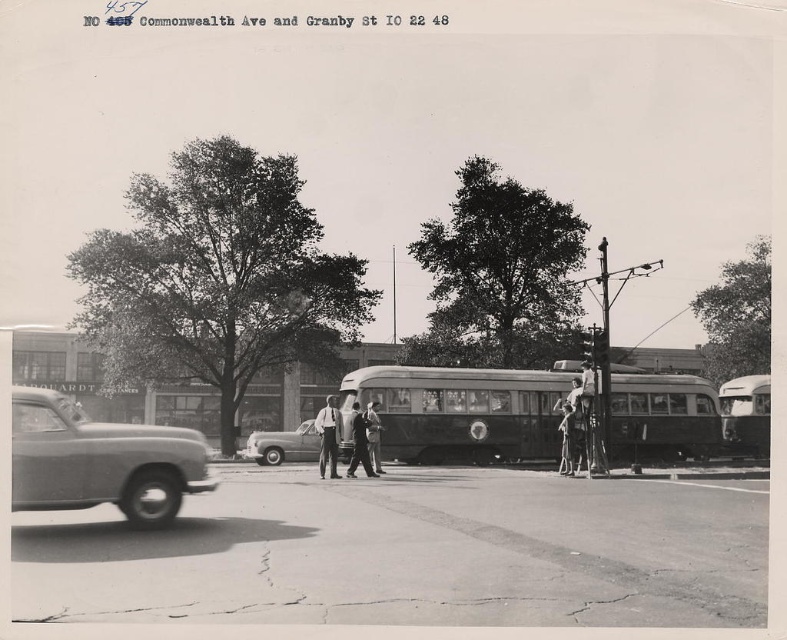
Question: Which of the following is the closest to the observer?

Choices:
 (A) (353, 416)
 (B) (91, 429)

Answer: (B)

Question: Does shiny silver sedan at center appear over light brown leather jacket at center?

Choices:
 (A) yes
 (B) no

Answer: (B)

Question: Can you confirm if matte gray car at left is positioned below light brown leather jacket at center?

Choices:
 (A) yes
 (B) no

Answer: (B)

Question: Which object appears closest to the camera in this image?

Choices:
 (A) dark suit at center
 (B) metallic silver bus at right
 (C) smooth gray suit at center

Answer: (A)

Question: Which object is the closest to the smooth leather jacket at center?

Choices:
 (A) light brown leather jacket at center
 (B) shiny silver sedan at center
 (C) metallic silver bus at right
 (D) matte gray car at left

Answer: (A)

Question: Does dark gray metal bus at center appear over smooth gray suit at center?

Choices:
 (A) no
 (B) yes

Answer: (B)